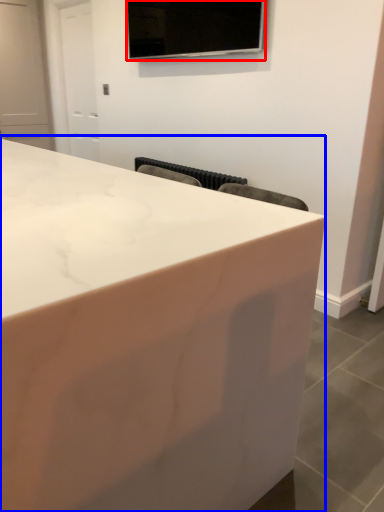
Question: Among these objects, which one is nearest to the camera, television (highlighted by a red box) or countertop (highlighted by a blue box)?

Choices:
 (A) television
 (B) countertop

Answer: (B)